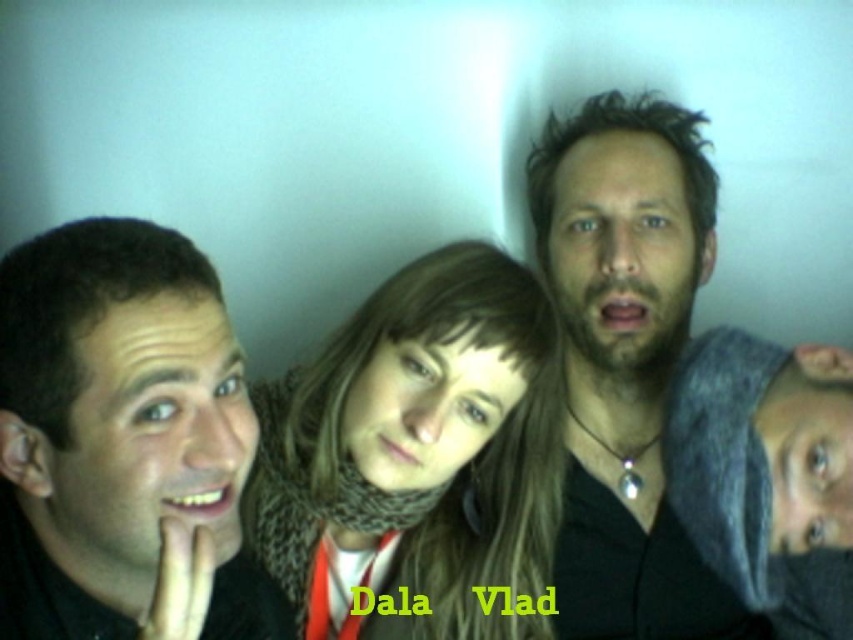
Question: Which object appears closest to the camera in this image?

Choices:
 (A) black matte face at left
 (B) matte black shirt at center

Answer: (A)

Question: Which of the following is the closest to the observer?

Choices:
 (A) (606, 600)
 (B) (10, 301)
 (C) (285, 472)

Answer: (B)

Question: Is black matte face at left bigger than knitted scarf at center?

Choices:
 (A) yes
 (B) no

Answer: (B)

Question: Does black matte face at left come in front of knitted scarf at center?

Choices:
 (A) no
 (B) yes

Answer: (B)

Question: Does black matte face at left appear over knitted scarf at center?

Choices:
 (A) yes
 (B) no

Answer: (B)

Question: Which object appears farthest from the camera in this image?

Choices:
 (A) black matte face at left
 (B) knitted scarf at center
 (C) matte black shirt at center

Answer: (C)